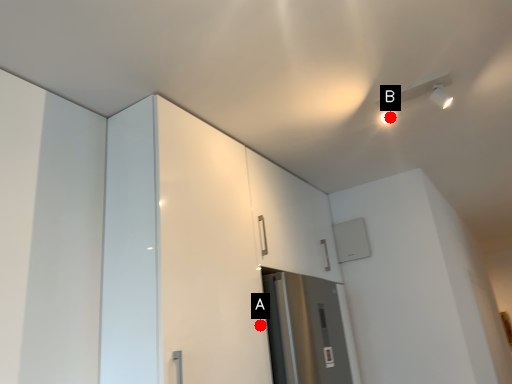
Question: Two points are circled on the image, labeled by A and B beside each circle. Which point is closer to the camera taking this photo?

Choices:
 (A) A is closer
 (B) B is closer

Answer: (A)